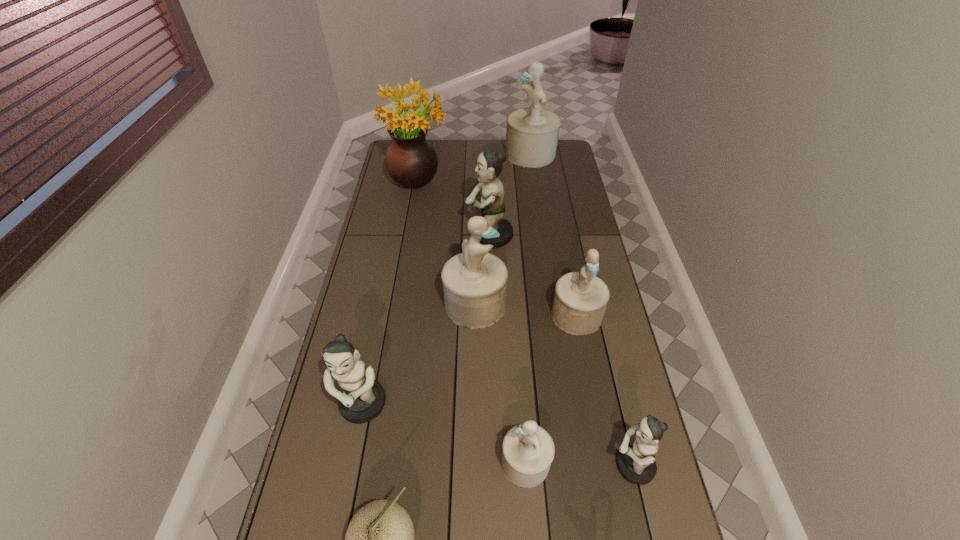
Where is `flower arrangement located in the left edge section of the desktop`? flower arrangement located in the left edge section of the desktop is located at coordinates (411, 161).

Locate an element on the screen. figurine that is at the left edge is located at coordinates 362,399.

Where is `object situated at the far left corner`? Image resolution: width=960 pixels, height=540 pixels. object situated at the far left corner is located at coordinates (411, 161).

Identify the location of object at the far right corner. (532, 133).

Locate an element on the screen. This screenshot has width=960, height=540. vacant space at the left edge is located at coordinates (383, 180).

In the image, there is a desktop. Where is `free space at the right edge`? free space at the right edge is located at coordinates (576, 373).

Where is `vacant space at the far right corner of the desktop`? vacant space at the far right corner of the desktop is located at coordinates (560, 159).

Find the location of a particular element. This screenshot has height=540, width=960. free space between the nearest white figurine and the leftmost green figurine is located at coordinates (444, 434).

Locate an element on the screen. This screenshot has height=540, width=960. free space that is in between the nearest white figurine and the third biggest white figurine is located at coordinates (551, 389).

I want to click on free spot between the flower arrangement and the farthest white figurine, so click(x=474, y=166).